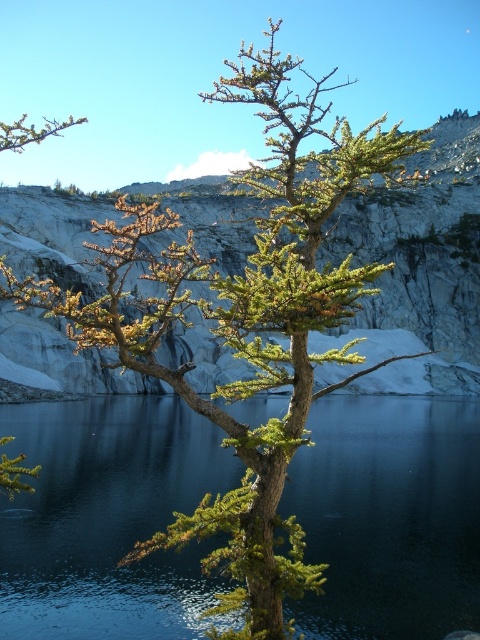
Which of these two, green glossy water at center or green textured rock at center, stands taller?

green textured rock at center

Is green glossy water at center shorter than green textured rock at center?

Yes, green glossy water at center is shorter than green textured rock at center.

Between point (381, 602) and point (462, 252), which one is positioned in front?

Point (381, 602) is in front.

The image size is (480, 640). I want to click on green glossy water at center, so click(107, 518).